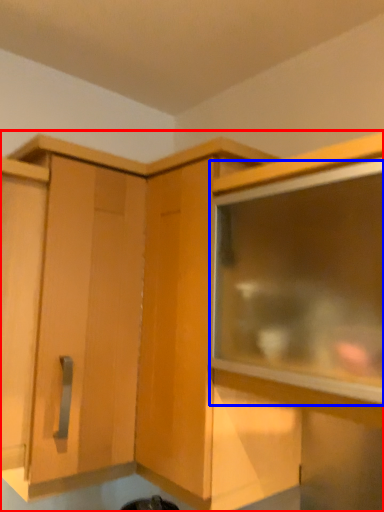
Question: Which of the following is the closest to the observer, cabinetry (highlighted by a red box) or window (highlighted by a blue box)?

Choices:
 (A) cabinetry
 (B) window

Answer: (B)